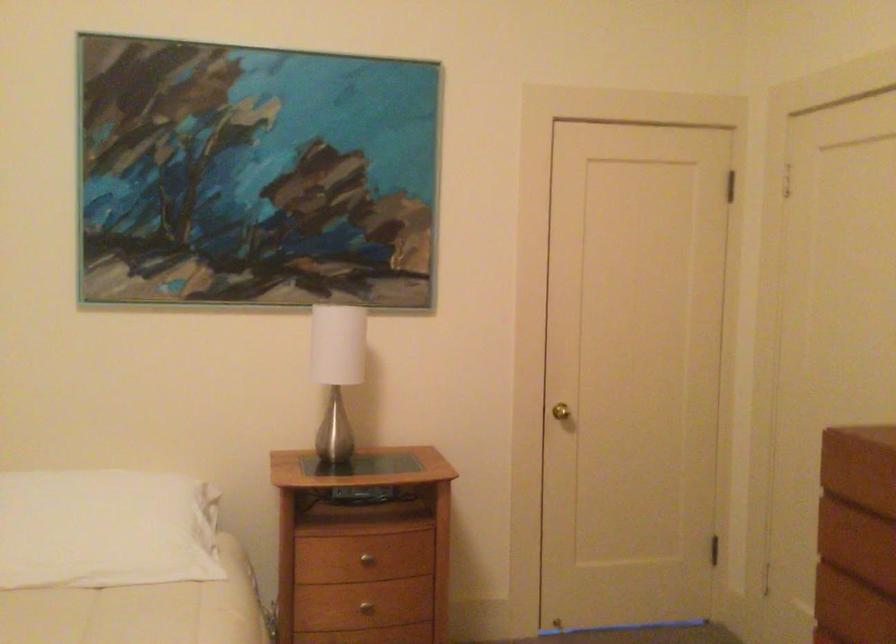
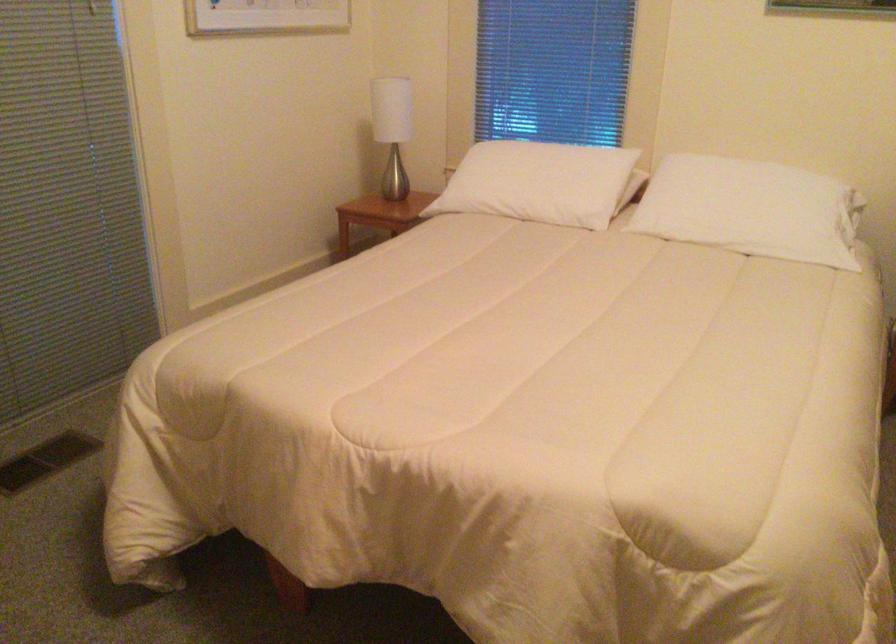
The point at (90, 545) is marked in the first image. Where is the corresponding point in the second image?

(752, 210)